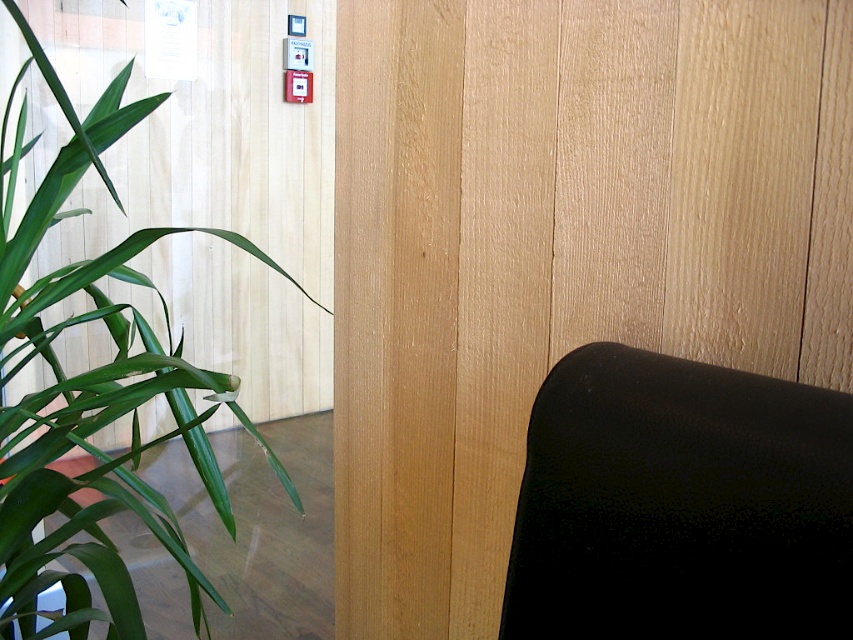
Which is below, black matte chair at right or green leafy plant at left?

green leafy plant at left is lower down.

Based on the photo, who is more forward, (837, 458) or (73, 392)?

Point (837, 458)

Image resolution: width=853 pixels, height=640 pixels. What are the coordinates of `black matte chair at right` in the screenshot? It's located at (680, 504).